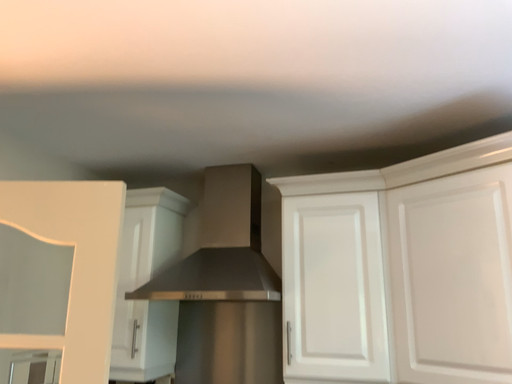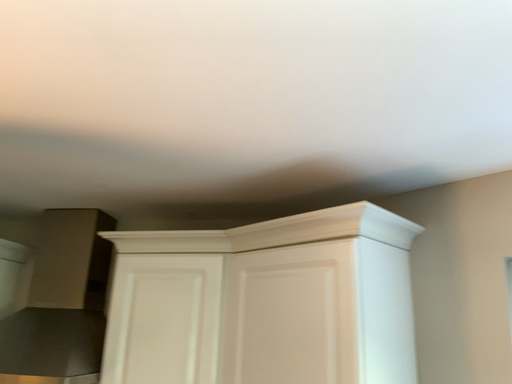
Question: Which way did the camera rotate in the video?

Choices:
 (A) rotated right
 (B) rotated left

Answer: (A)